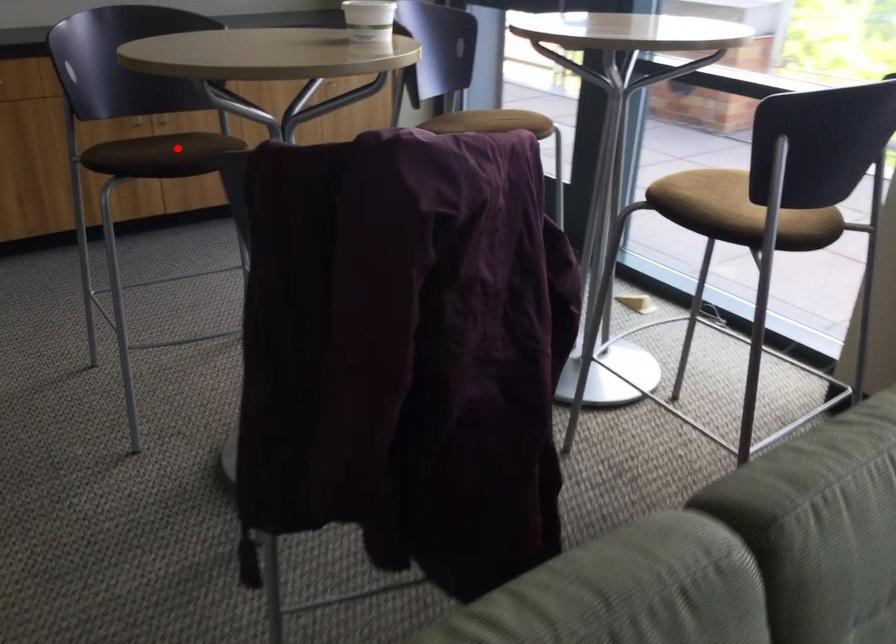
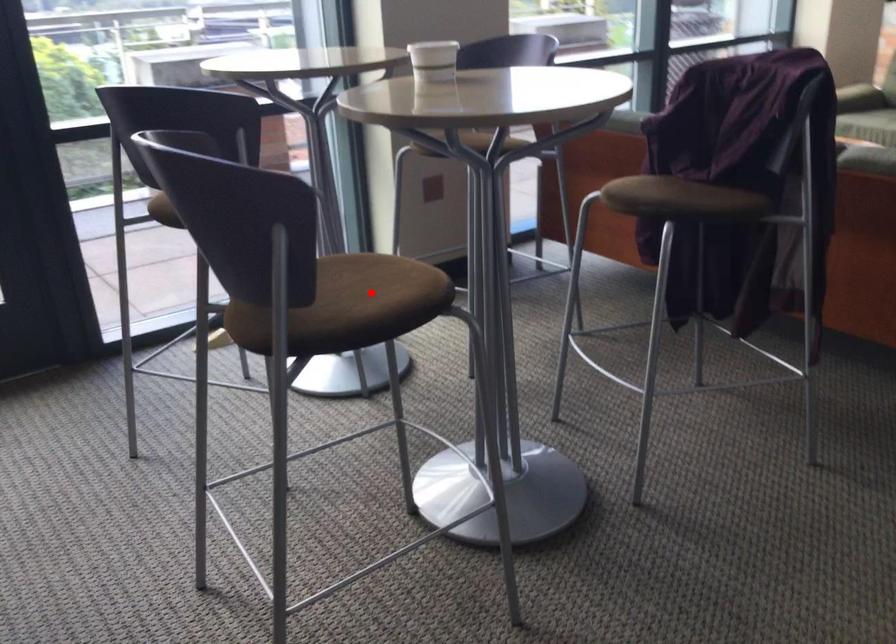
From the picture: I am providing you with two images of the same scene from different viewpoints. A red point is marked on the first image and another point is marked on the second image. Are the points marked in image1 and image2 representing the same 3D position?

Yes